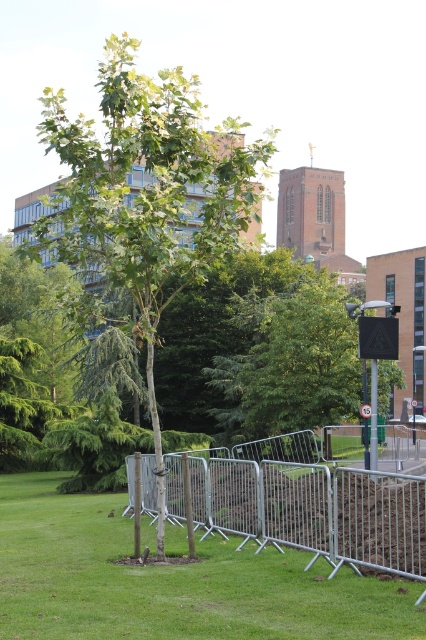
Does green grass at center come behind metallic pole at right?

No, it is not.

Does point (150, 602) lie in front of point (373, 428)?

Yes, point (150, 602) is in front of point (373, 428).

Where is `green grass at center`? This screenshot has width=426, height=640. green grass at center is located at coordinates (172, 580).

Does green leafy tree at center have a larger size compared to silver/galvanized metal fence at center?

Yes, green leafy tree at center is bigger than silver/galvanized metal fence at center.

Can you confirm if green leafy tree at center is positioned to the right of silver/galvanized metal fence at center?

In fact, green leafy tree at center is to the left of silver/galvanized metal fence at center.

Is point (154, 268) positioned after point (308, 433)?

No, (154, 268) is in front of (308, 433).

I want to click on green leafy tree at center, so click(146, 196).

Which of these two, green grass at center or silver/galvanized metal fence at center, stands taller?

green grass at center is taller.

Does green grass at center have a lesser height compared to silver/galvanized metal fence at center?

In fact, green grass at center may be taller than silver/galvanized metal fence at center.

Between point (259, 618) and point (353, 512), which one is positioned behind?

Positioned behind is point (353, 512).

Locate an element on the screen. green grass at center is located at coordinates (172, 580).